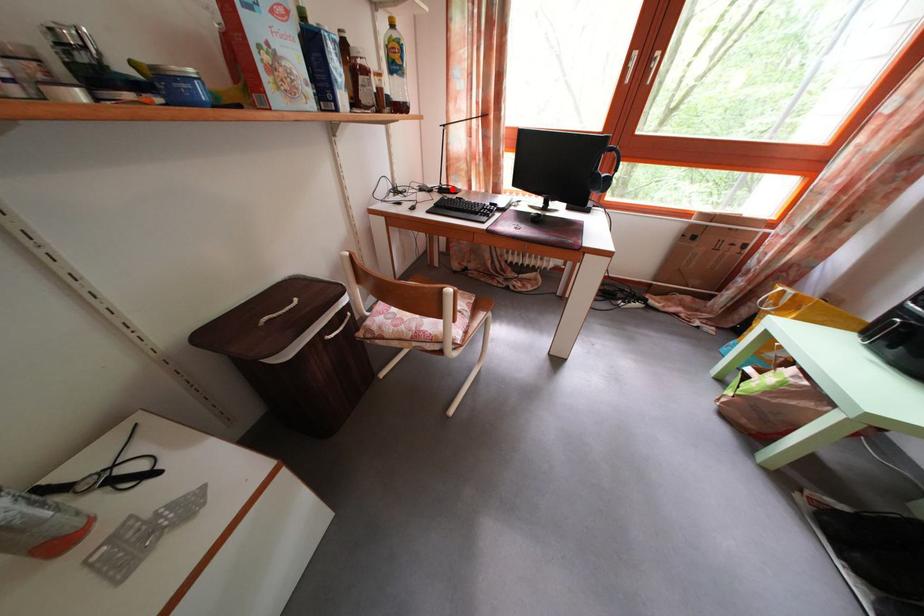
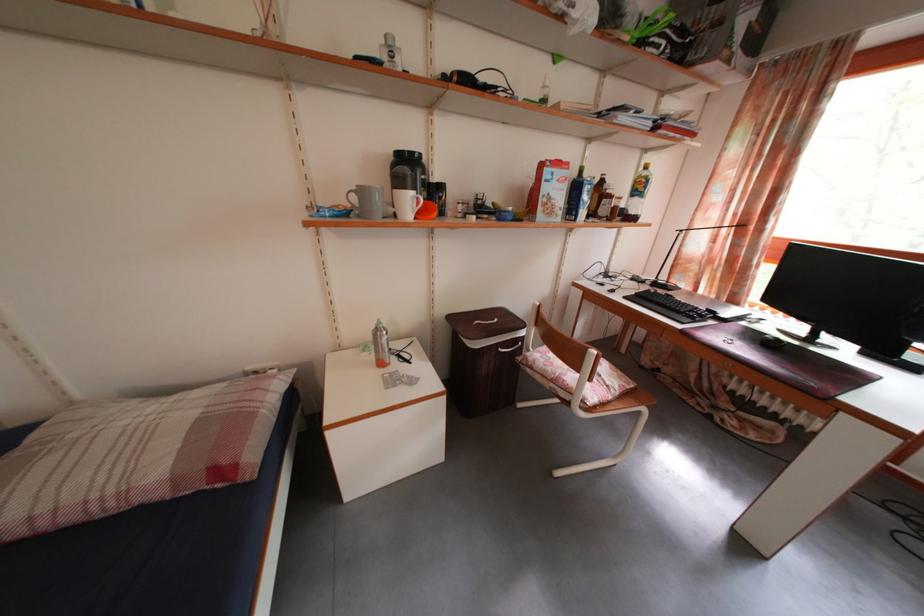
The point at the highlighted location is marked in the first image. Where is the corresponding point in the second image?

(671, 285)